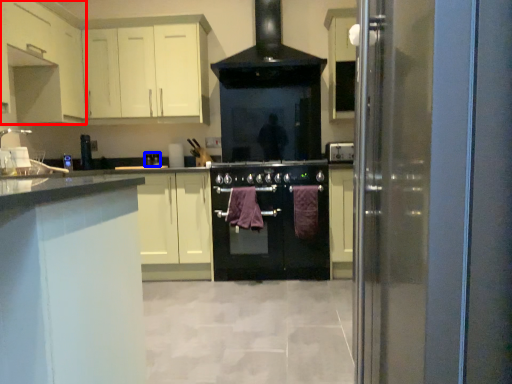
Question: Among these objects, which one is nearest to the camera, cabinetry (highlighted by a red box) or appliance (highlighted by a blue box)?

Choices:
 (A) cabinetry
 (B) appliance

Answer: (A)